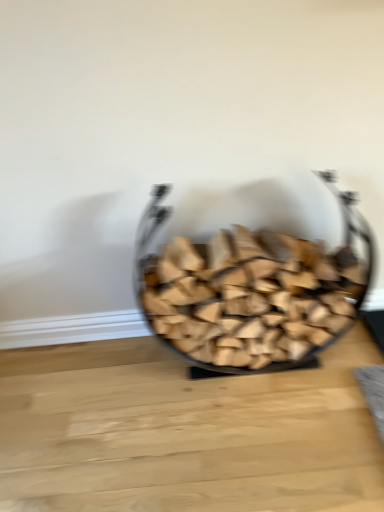
Find the location of `vacant area situated to the left side of wooden logs at center`. vacant area situated to the left side of wooden logs at center is located at coordinates (101, 406).